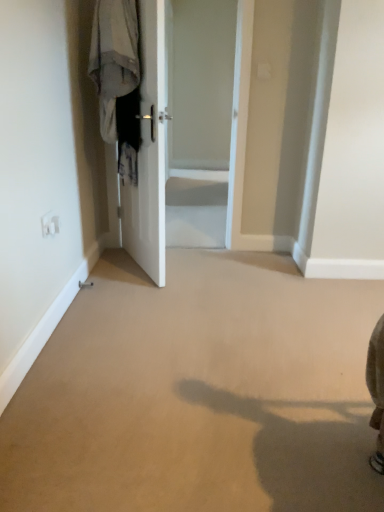
Describe the element at coordinates (117, 79) in the screenshot. I see `light gray fabric at left` at that location.

Identify the location of white glossy door at center. (149, 152).

Is white glossy door at center not close to light gray fabric at left?

white glossy door at center is actually quite close to light gray fabric at left.

Does white glossy door at center turn towards light gray fabric at left?

Yes, white glossy door at center is aimed at light gray fabric at left.

From a real-world perspective, between white glossy door at center and light gray fabric at left, who is vertically higher?

In real-world perspective, light gray fabric at left is above.

Does light gray fabric at left turn towards white glossy door at center?

Yes, light gray fabric at left is oriented towards white glossy door at center.

Does light gray fabric at left have a greater height compared to white glossy door at center?

In fact, light gray fabric at left may be shorter than white glossy door at center.

In the scene shown: Who is more distant, light gray fabric at left or white glossy door at center?

light gray fabric at left is behind.

From a real-world perspective, who is located higher, light gray fabric at left or white glossy door at center?

light gray fabric at left, from a real-world perspective.

From the image's perspective, is light gray fabric at left located above or below white glossy door at center?

light gray fabric at left is above white glossy door at center.

Is light gray fabric at left positioned beyond the bounds of white glossy door at center?

Yes, light gray fabric at left is not within white glossy door at center.

From a real-world perspective, who is located lower, light gray fabric at left or white glossy door at center?

white glossy door at center.

Could you tell me if light gray fabric at left is turned towards white glossy door at center?

No, light gray fabric at left is not oriented towards white glossy door at center.

At what (x,y) coordinates should I click in order to perform the action: click on screen door on the right side of white glossy door at center. Please return your answer as a coordinate pair (x, y). The image size is (384, 512). Looking at the image, I should click on (199, 119).

From a real-world perspective, which is physically above, white glossy door at center or white glossy door at center?

From a 3D spatial view, white glossy door at center is above.

Measure the distance between white glossy door at center and white glossy door at center.

white glossy door at center is 1.68 meters away from white glossy door at center.

Considering the sizes of objects white glossy door at center and white glossy door at center in the image provided, who is taller, white glossy door at center or white glossy door at center?

With more height is white glossy door at center.

Would you say white glossy door at center is a long distance from white glossy door at center?

Absolutely, white glossy door at center is distant from white glossy door at center.

Does white glossy door at center appear on the right side of white glossy door at center?

Incorrect, white glossy door at center is not on the right side of white glossy door at center.

Image resolution: width=384 pixels, height=512 pixels. Find the location of `screen door above the white glossy door at center (from a real-world perspective)`. screen door above the white glossy door at center (from a real-world perspective) is located at coordinates (199, 119).

Considering the relative positions of white glossy door at center and light gray fabric at left in the image provided, is white glossy door at center to the left of light gray fabric at left from the viewer's perspective?

Incorrect, white glossy door at center is not on the left side of light gray fabric at left.

Is white glossy door at center not near light gray fabric at left?

Yes, white glossy door at center and light gray fabric at left are quite far apart.

Considering the sizes of white glossy door at center and light gray fabric at left in the image, is white glossy door at center wider or thinner than light gray fabric at left?

white glossy door at center is thinner than light gray fabric at left.

Between white glossy door at center and light gray fabric at left, which one has larger size?

With larger size is white glossy door at center.

You are a GUI agent. You are given a task and a screenshot of the screen. Output one action in this format:
    pyautogui.click(x=<x>, y=<y>)
    Task: Click on the door on the right of the light gray fabric at left
    The height and width of the screenshot is (512, 384).
    Given the screenshot: What is the action you would take?
    (x=149, y=152)

Locate an element on the screen. This screenshot has height=512, width=384. laundry that is behind the white glossy door at center is located at coordinates (117, 79).

From the image, which object appears to be farther from light gray fabric at left, white glossy door at center or white glossy door at center?

white glossy door at center.

Which object lies further to the anchor point white glossy door at center, white glossy door at center or light gray fabric at left?

The object further to white glossy door at center is light gray fabric at left.

Which object lies further to the anchor point white glossy door at center, light gray fabric at left or white glossy door at center?

white glossy door at center.

Estimate the real-world distances between objects in this image. Which object is further from white glossy door at center, white glossy door at center or light gray fabric at left?

Based on the image, white glossy door at center appears to be further to white glossy door at center.

When comparing their distances from light gray fabric at left, does white glossy door at center or white glossy door at center seem closer?

white glossy door at center is positioned closer to the anchor light gray fabric at left.

When comparing their distances from white glossy door at center, does light gray fabric at left or white glossy door at center seem further?

light gray fabric at left lies further to white glossy door at center than the other object.

This screenshot has width=384, height=512. I want to click on laundry between white glossy door at center and white glossy door at center from front to back, so click(117, 79).